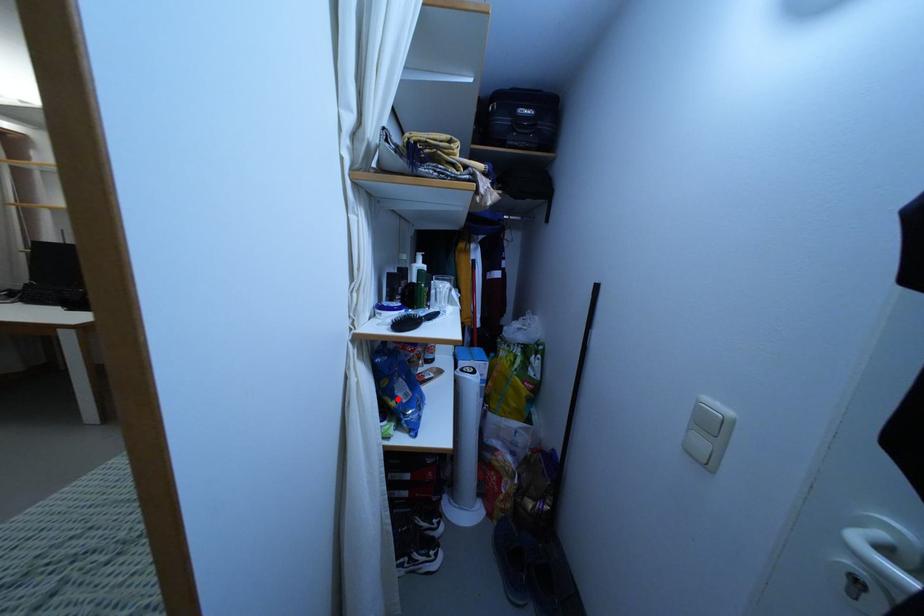
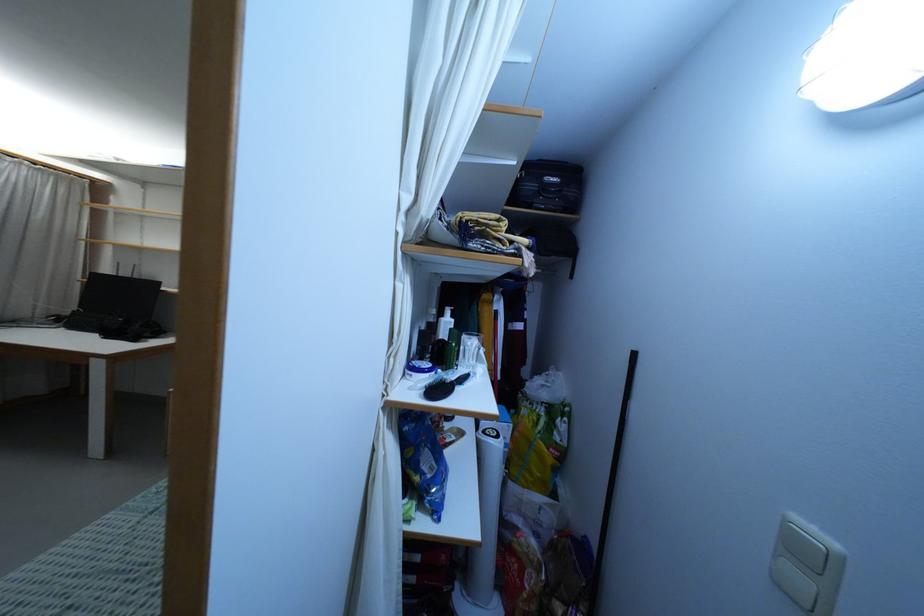
Where in the second image is the point corresponding to the highlighted location from the first image?

(422, 474)